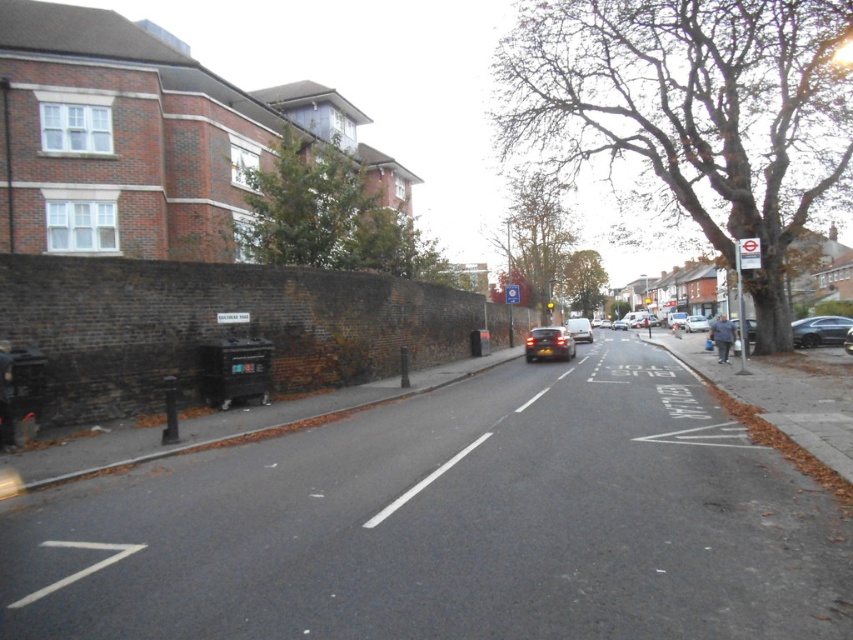
You are a delivery person needing to park your 2.5 meter wide van between the shiny black car at right and the shiny silver car at center. Can you fit your van there?

The shiny black car at right is wider than the shiny silver car at center. Since your van is 2.5 meters wide, you need to check the space between them. If the distance between the two cars is greater than 2.5 meters, then yes, you can park. However, if the space is narrower than 2.5 meters, it won

You are standing at the point with coordinates point [561,348] and want to walk to the point with coordinates point [836,337]. Is the destination point behind or in front of your current position?

The destination point [836,337] is behind your current position at point [561,348] according to the spatial relationship provided.

You are a pedestrian standing on the sidewalk in front of the large brick building. You need to cross the street to reach the other side. Is the shiny black car at right blocking your path to the silver metallic van at center?

The shiny black car at right is below the silver metallic van at center, so it is positioned lower and likely closer to the ground. This means the shiny black car at right is not blocking the path to the silver metallic van at center since they are at different vertical levels.